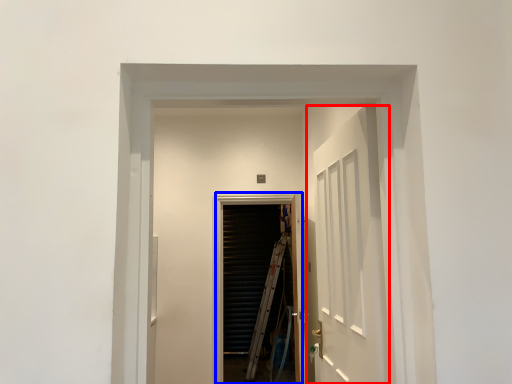
Question: Which object appears closest to the camera in this image, door (highlighted by a red box) or screen door (highlighted by a blue box)?

Choices:
 (A) door
 (B) screen door

Answer: (A)